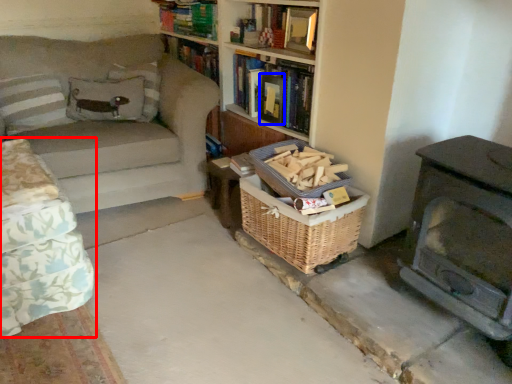
Question: Which object is further to the camera taking this photo, studio couch (highlighted by a red box) or paperback book (highlighted by a blue box)?

Choices:
 (A) studio couch
 (B) paperback book

Answer: (B)